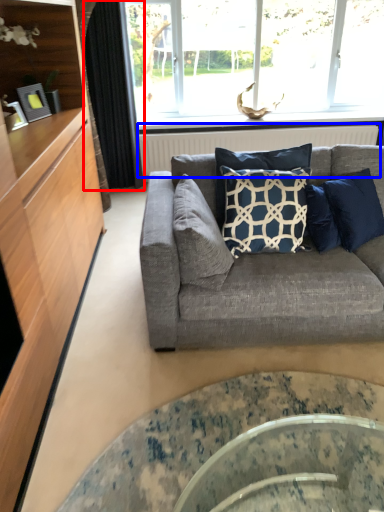
Question: Which of the following is the closest to the observer, curtain (highlighted by a red box) or radiator (highlighted by a blue box)?

Choices:
 (A) curtain
 (B) radiator

Answer: (A)